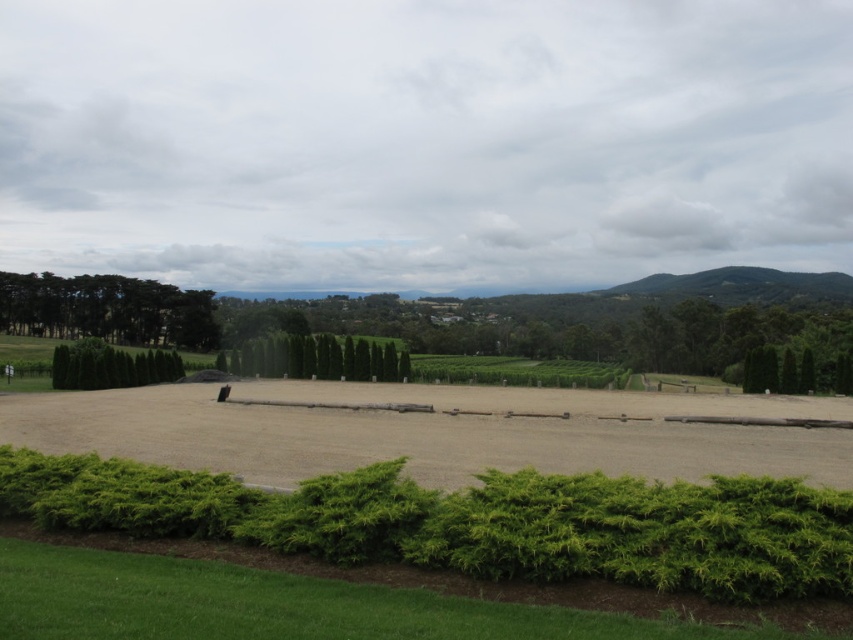
Is green leafy hedge at lower center further to camera compared to green textured hedge at center?

That is False.

How much distance is there between green leafy hedge at lower center and green textured hedge at center?

green leafy hedge at lower center is 49.53 meters from green textured hedge at center.

Is point (564, 500) positioned behind point (393, 353)?

No, it is in front of (393, 353).

Where is `green leafy hedge at lower center`? Image resolution: width=853 pixels, height=640 pixels. green leafy hedge at lower center is located at coordinates (473, 522).

Can you confirm if green leafy hedge at lower center is smaller than green leafy hedge at left?

Correct, green leafy hedge at lower center occupies less space than green leafy hedge at left.

How much distance is there between green leafy hedge at lower center and green leafy hedge at left?

They are 49.90 meters apart.

Does point (215, 483) come closer to viewer compared to point (96, 342)?

Yes.

Where is `green leafy hedge at lower center`? This screenshot has height=640, width=853. green leafy hedge at lower center is located at coordinates (473, 522).

Does green textured hedge at center have a larger size compared to green leafy hedge at left?

Indeed, green textured hedge at center has a larger size compared to green leafy hedge at left.

Is green textured hedge at center in front of green leafy hedge at left?

That is False.

The width and height of the screenshot is (853, 640). Find the location of `green textured hedge at center`. green textured hedge at center is located at coordinates (317, 358).

Where is `green textured hedge at center`? Image resolution: width=853 pixels, height=640 pixels. green textured hedge at center is located at coordinates (317, 358).